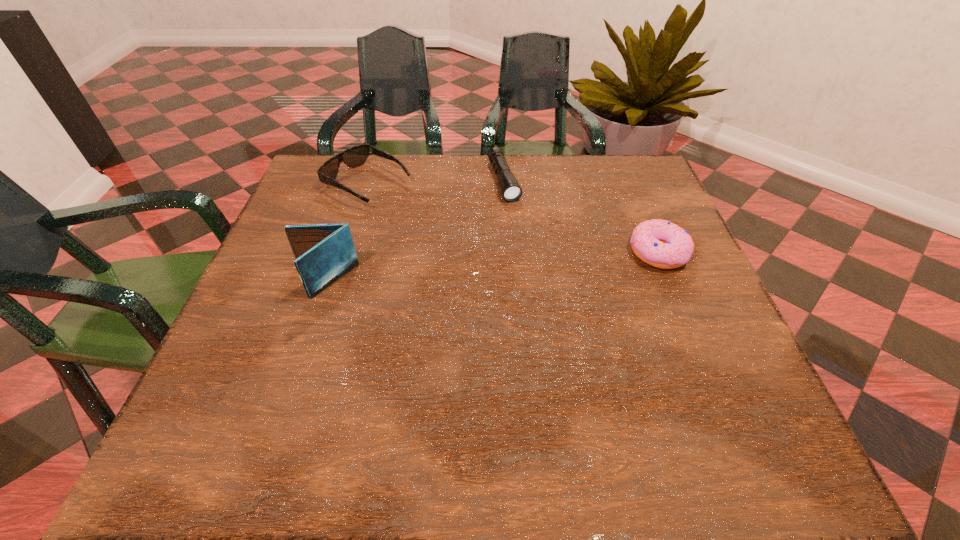
The height and width of the screenshot is (540, 960). In the image, there is a desktop. Find the location of `vacant space at the left edge`. vacant space at the left edge is located at coordinates (339, 213).

Identify the location of vacant space at the right edge. (715, 328).

The height and width of the screenshot is (540, 960). Identify the location of free point at the near left corner. (237, 407).

In the image, there is a desktop. At what (x,y) coordinates should I click in order to perform the action: click on free space at the near right corner. Please return your answer as a coordinate pair (x, y). Looking at the image, I should click on (705, 400).

This screenshot has height=540, width=960. Find the location of `vacant area that lies between the wallet and the doughnut`. vacant area that lies between the wallet and the doughnut is located at coordinates (491, 267).

Identify the location of unoccupied area between the rightmost object and the second object from right to left. (581, 217).

Find the location of a particular element. The height and width of the screenshot is (540, 960). free space between the rightmost object and the sunglasses is located at coordinates (514, 219).

Where is `free area in between the doughnut and the flashlight`? The image size is (960, 540). free area in between the doughnut and the flashlight is located at coordinates (581, 217).

This screenshot has height=540, width=960. In order to click on unoccupied area between the rightmost object and the tallest object in this screenshot , I will do `click(491, 267)`.

The height and width of the screenshot is (540, 960). Find the location of `vacant area that lies between the sunglasses and the third object from left to right`. vacant area that lies between the sunglasses and the third object from left to right is located at coordinates (436, 183).